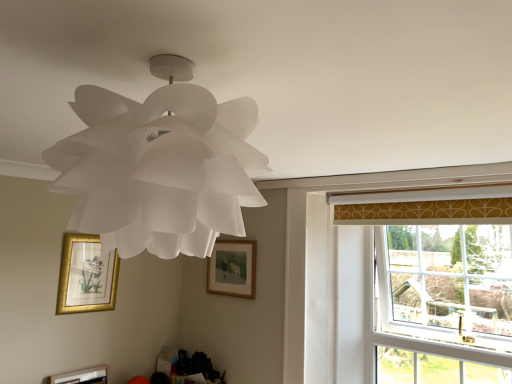
What do you see at coordinates (232, 268) in the screenshot? Image resolution: width=512 pixels, height=384 pixels. I see `wooden framed picture at center, the first picture frame viewed from the right` at bounding box center [232, 268].

Measure the distance between point (246,279) and camera.

2.43 meters.

Describe the element at coordinates (82, 376) in the screenshot. This screenshot has width=512, height=384. I see `wooden picture frame at lower left, arranged as the 1th picture frame when ordered from the bottom` at that location.

You are a GUI agent. You are given a task and a screenshot of the screen. Output one action in this format:
    pyautogui.click(x=<x>, y=<y>)
    Task: Click on the gold framed picture at lower left, which is counted as the second picture frame, starting from the right
    This screenshot has height=384, width=512.
    Given the screenshot: What is the action you would take?
    pyautogui.click(x=86, y=276)

This screenshot has width=512, height=384. Identify the location of white paper lamp at upper center. (159, 166).

How different are the orientations of wooden framed picture at center, the first picture frame viewed from the right, and gold framed picture at lower left, positioned as the 2th picture frame in top-to-bottom order, in degrees?

The facing directions of wooden framed picture at center, the first picture frame viewed from the right, and gold framed picture at lower left, positioned as the 2th picture frame in top-to-bottom order, are 90.7 degrees apart.

Considering the positions of points (242, 258) and (95, 297), is point (242, 258) farther from camera compared to point (95, 297)?

Yes, it is behind point (95, 297).

Which object is more forward, wooden framed picture at center, the first picture frame viewed from the right, or gold framed picture at lower left, placed as the 2th picture frame when sorted from bottom to top?

gold framed picture at lower left, placed as the 2th picture frame when sorted from bottom to top, is in front.

Can we say wooden framed picture at center, the first picture frame viewed from the right, lies outside gold framed picture at lower left, positioned as the 2th picture frame in top-to-bottom order?

Yes, wooden framed picture at center, the first picture frame viewed from the right, is outside of gold framed picture at lower left, positioned as the 2th picture frame in top-to-bottom order.

Do you think gold framed picture at lower left, which ranks as the 2th picture frame in left-to-right order, is within wooden picture frame at lower left, which is the 3th picture frame from top to bottom, or outside of it?

gold framed picture at lower left, which ranks as the 2th picture frame in left-to-right order, cannot be found inside wooden picture frame at lower left, which is the 3th picture frame from top to bottom.

Considering the relative positions of gold framed picture at lower left, placed as the 2th picture frame when sorted from bottom to top, and wooden picture frame at lower left, which appears as the 1th picture frame when viewed from the left, in the image provided, is gold framed picture at lower left, placed as the 2th picture frame when sorted from bottom to top, to the right of wooden picture frame at lower left, which appears as the 1th picture frame when viewed from the left, from the viewer's perspective?

Yes, gold framed picture at lower left, placed as the 2th picture frame when sorted from bottom to top, is to the right of wooden picture frame at lower left, which appears as the 1th picture frame when viewed from the left.

From a real-world perspective, who is located higher, gold framed picture at lower left, which is counted as the second picture frame, starting from the right, or wooden picture frame at lower left, arranged as the 1th picture frame when ordered from the bottom?

gold framed picture at lower left, which is counted as the second picture frame, starting from the right, from a real-world perspective.

Which of these two, wooden framed picture at center, the first picture frame viewed from the right, or white paper lamp at upper center, stands shorter?

wooden framed picture at center, the first picture frame viewed from the right.

Considering the positions of points (228, 245) and (76, 113), is point (228, 245) closer to camera compared to point (76, 113)?

No.

From a real-world perspective, who is located lower, wooden framed picture at center, the 1th picture frame when ordered from top to bottom, or white paper lamp at upper center?

From a 3D spatial view, wooden framed picture at center, the 1th picture frame when ordered from top to bottom, is below.

Is point (101, 178) more distant than point (413, 233)?

No.

Is white paper lamp at upper center far away from clear glass window at right?

white paper lamp at upper center is positioned a significant distance from clear glass window at right.

The height and width of the screenshot is (384, 512). I want to click on lamp lying above the clear glass window at right (from the image's perspective), so click(x=159, y=166).

Does white paper lamp at upper center turn towards clear glass window at right?

No, white paper lamp at upper center is not aimed at clear glass window at right.

From the image's perspective, is gold framed picture at lower left, placed as the 2th picture frame when sorted from bottom to top, on wooden framed picture at center, which is counted as the third picture frame, starting from the bottom?

No, from the image's perspective, gold framed picture at lower left, placed as the 2th picture frame when sorted from bottom to top, is not over wooden framed picture at center, which is counted as the third picture frame, starting from the bottom.

Between gold framed picture at lower left, positioned as the 2th picture frame in top-to-bottom order, and wooden framed picture at center, which is counted as the third picture frame, starting from the bottom, which one is positioned in front?

Positioned in front is gold framed picture at lower left, positioned as the 2th picture frame in top-to-bottom order.

Measure the distance from gold framed picture at lower left, which ranks as the 2th picture frame in left-to-right order, to wooden framed picture at center, the 3th picture frame from the left.

gold framed picture at lower left, which ranks as the 2th picture frame in left-to-right order, is 26.87 inches from wooden framed picture at center, the 3th picture frame from the left.

From the picture: Considering the relative sizes of gold framed picture at lower left, placed as the 2th picture frame when sorted from bottom to top, and wooden framed picture at center, the 1th picture frame when ordered from top to bottom, in the image provided, is gold framed picture at lower left, placed as the 2th picture frame when sorted from bottom to top, wider than wooden framed picture at center, the 1th picture frame when ordered from top to bottom,?

Indeed, gold framed picture at lower left, placed as the 2th picture frame when sorted from bottom to top, has a greater width compared to wooden framed picture at center, the 1th picture frame when ordered from top to bottom.

Is wooden picture frame at lower left, which appears as the 3th picture frame when viewed from the right, oriented towards wooden framed picture at center, the 1th picture frame when ordered from top to bottom?

No.

Which of these two, wooden picture frame at lower left, which appears as the 3th picture frame when viewed from the right, or wooden framed picture at center, which is counted as the third picture frame, starting from the bottom, is bigger?

With larger size is wooden picture frame at lower left, which appears as the 3th picture frame when viewed from the right.

Would you say wooden picture frame at lower left, which appears as the 3th picture frame when viewed from the right, is outside wooden framed picture at center, which is counted as the third picture frame, starting from the bottom?

Absolutely, wooden picture frame at lower left, which appears as the 3th picture frame when viewed from the right, is external to wooden framed picture at center, which is counted as the third picture frame, starting from the bottom.

Which is in front, wooden picture frame at lower left, which appears as the 1th picture frame when viewed from the left, or wooden framed picture at center, the first picture frame viewed from the right?

Positioned in front is wooden picture frame at lower left, which appears as the 1th picture frame when viewed from the left.

Is wooden framed picture at center, the 1th picture frame when ordered from top to bottom, a part of clear glass window at right?

No, wooden framed picture at center, the 1th picture frame when ordered from top to bottom, is located outside of clear glass window at right.

From the image's perspective, is clear glass window at right under wooden framed picture at center, the 3th picture frame from the left?

Indeed, from the image's perspective, clear glass window at right is shown beneath wooden framed picture at center, the 3th picture frame from the left.

Is clear glass window at right shorter than wooden framed picture at center, which is counted as the third picture frame, starting from the bottom?

No, clear glass window at right is not shorter than wooden framed picture at center, which is counted as the third picture frame, starting from the bottom.

How many degrees apart are the facing directions of clear glass window at right and wooden framed picture at center, the first picture frame viewed from the right?

The facing directions of clear glass window at right and wooden framed picture at center, the first picture frame viewed from the right, are 1.43 degrees apart.

This screenshot has width=512, height=384. What are the coordinates of `picture frame above the gold framed picture at lower left, positioned as the 2th picture frame in top-to-bottom order (from the image's perspective)` in the screenshot? It's located at (232, 268).

Locate an element on the screen. Image resolution: width=512 pixels, height=384 pixels. picture frame in front of the gold framed picture at lower left, which is counted as the second picture frame, starting from the right is located at coordinates (82, 376).

Based on their spatial positions, is wooden framed picture at center, which is counted as the third picture frame, starting from the bottom, or wooden picture frame at lower left, which appears as the 3th picture frame when viewed from the right, closer to gold framed picture at lower left, which is counted as the second picture frame, starting from the right?

wooden picture frame at lower left, which appears as the 3th picture frame when viewed from the right, lies closer to gold framed picture at lower left, which is counted as the second picture frame, starting from the right, than the other object.

Estimate the real-world distances between objects in this image. Which object is closer to wooden framed picture at center, which is counted as the third picture frame, starting from the bottom, wooden picture frame at lower left, which appears as the 1th picture frame when viewed from the left, or clear glass window at right?

wooden picture frame at lower left, which appears as the 1th picture frame when viewed from the left, is closer to wooden framed picture at center, which is counted as the third picture frame, starting from the bottom.

When comparing their distances from wooden framed picture at center, the first picture frame viewed from the right, does clear glass window at right or gold framed picture at lower left, placed as the 2th picture frame when sorted from bottom to top, seem closer?

gold framed picture at lower left, placed as the 2th picture frame when sorted from bottom to top, is positioned closer to the anchor wooden framed picture at center, the first picture frame viewed from the right.

In the scene shown: From the image, which object appears to be nearer to wooden framed picture at center, which is counted as the third picture frame, starting from the bottom, white paper lamp at upper center or wooden picture frame at lower left, arranged as the 1th picture frame when ordered from the bottom?

wooden picture frame at lower left, arranged as the 1th picture frame when ordered from the bottom, lies closer to wooden framed picture at center, which is counted as the third picture frame, starting from the bottom, than the other object.

From the image, which object appears to be farther from clear glass window at right, wooden picture frame at lower left, arranged as the 1th picture frame when ordered from the bottom, or wooden framed picture at center, which is counted as the third picture frame, starting from the bottom?

Among the two, wooden picture frame at lower left, arranged as the 1th picture frame when ordered from the bottom, is located further to clear glass window at right.

Considering their positions, is white paper lamp at upper center positioned closer to clear glass window at right than gold framed picture at lower left, which is counted as the second picture frame, starting from the right?

Among the two, gold framed picture at lower left, which is counted as the second picture frame, starting from the right, is located nearer to clear glass window at right.

Considering their positions, is clear glass window at right positioned further to white paper lamp at upper center than wooden framed picture at center, the 3th picture frame from the left?

The object further to white paper lamp at upper center is clear glass window at right.

Which object lies nearer to the anchor point wooden picture frame at lower left, which appears as the 3th picture frame when viewed from the right, gold framed picture at lower left, which ranks as the 2th picture frame in left-to-right order, or wooden framed picture at center, the 1th picture frame when ordered from top to bottom?

gold framed picture at lower left, which ranks as the 2th picture frame in left-to-right order, is closer to wooden picture frame at lower left, which appears as the 3th picture frame when viewed from the right.

Locate an element on the screen. This screenshot has width=512, height=384. picture frame situated between gold framed picture at lower left, which is counted as the second picture frame, starting from the right, and clear glass window at right from left to right is located at coordinates (232, 268).

Where is `picture frame positioned between white paper lamp at upper center and gold framed picture at lower left, positioned as the 2th picture frame in top-to-bottom order, from near to far`? The width and height of the screenshot is (512, 384). picture frame positioned between white paper lamp at upper center and gold framed picture at lower left, positioned as the 2th picture frame in top-to-bottom order, from near to far is located at coordinates (82, 376).

This screenshot has width=512, height=384. I want to click on window between white paper lamp at upper center and wooden framed picture at center, which is counted as the third picture frame, starting from the bottom, from front to back, so click(442, 306).

Identify the location of lamp between wooden picture frame at lower left, arranged as the 1th picture frame when ordered from the bottom, and clear glass window at right. This screenshot has height=384, width=512. (159, 166).